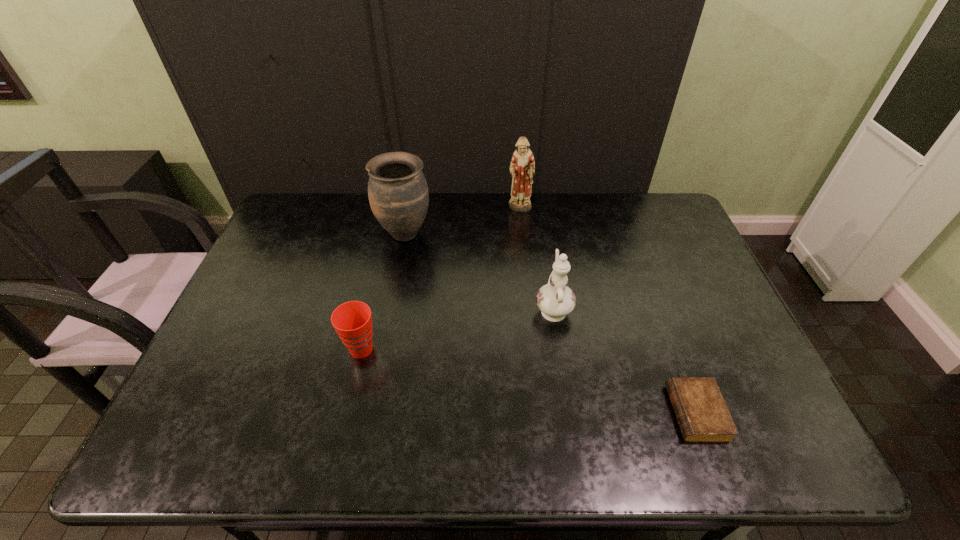
The image size is (960, 540). Identify the location of free point between the figurine and the cup. (441, 280).

Find the location of a particular element. The height and width of the screenshot is (540, 960). free area in between the urn and the chinaware is located at coordinates (479, 271).

The height and width of the screenshot is (540, 960). In order to click on vacant space that is in between the urn and the figurine in this screenshot , I will do `click(463, 221)`.

Where is `vacant region between the urn and the nearest object`? This screenshot has height=540, width=960. vacant region between the urn and the nearest object is located at coordinates (550, 323).

You are a GUI agent. You are given a task and a screenshot of the screen. Output one action in this format:
    pyautogui.click(x=<x>, y=<y>)
    Task: Click on the free space between the fourth tallest object and the urn
    
    Given the screenshot: What is the action you would take?
    pyautogui.click(x=383, y=291)

Identify the location of empty space between the third farthest object and the urn. The height and width of the screenshot is (540, 960). (479, 271).

Locate an element on the screen. This screenshot has width=960, height=540. blank region between the urn and the figurine is located at coordinates (463, 221).

Find the location of a particular element. The width and height of the screenshot is (960, 540). vacant area that lies between the rightmost object and the figurine is located at coordinates (608, 311).

Locate an element on the screen. the second closest object to the urn is located at coordinates (352, 321).

Locate which object is the third closest to the figurine. Please provide its 2D coordinates. Your answer should be formatted as a tuple, i.e. [(x, y)], where the tuple contains the x and y coordinates of a point satisfying the conditions above.

[(352, 321)]